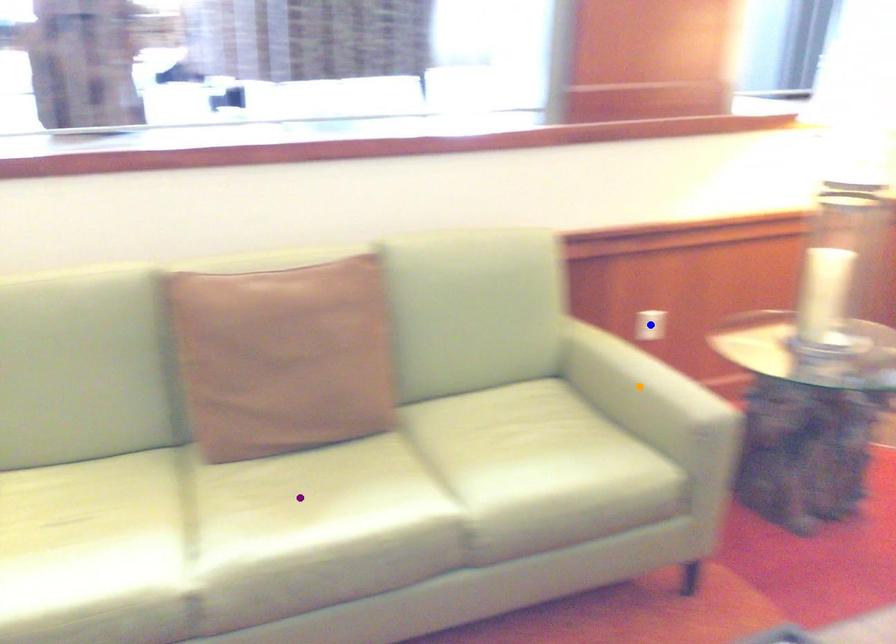
Order these from nearest to farthest:
blue point | orange point | purple point

1. purple point
2. orange point
3. blue point